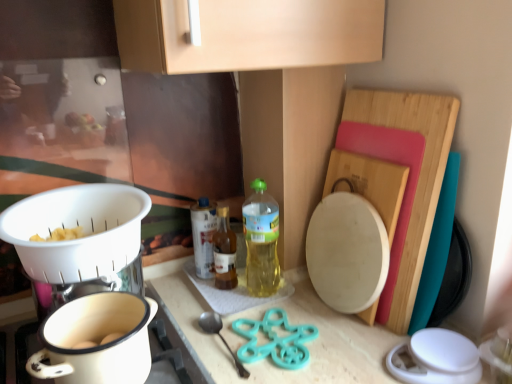
What is the approximate width of translucent plastic bottle at center, positioned as the 1th bottle in left-to-right order?

3.35 inches.

This screenshot has height=384, width=512. What do you see at coordinates (219, 336) in the screenshot?
I see `teal plastic spoon at lower center` at bounding box center [219, 336].

Where is `translucent plastic bottle at center, which ranks as the 3th bottle in left-to-right order`? Image resolution: width=512 pixels, height=384 pixels. translucent plastic bottle at center, which ranks as the 3th bottle in left-to-right order is located at coordinates (261, 241).

The image size is (512, 384). Describe the element at coordinates (261, 241) in the screenshot. I see `translucent plastic bottle at center, which is the 1th bottle from right to left` at that location.

Find the location of `white ceramic pot at lower left`. white ceramic pot at lower left is located at coordinates (96, 341).

The height and width of the screenshot is (384, 512). Find the location of `white plastic colander at left`. white plastic colander at left is located at coordinates (81, 236).

Is teal plastic spoon at lower center oriented towards translucent glass bottle at center, marked as the second bottle in a left-to-right arrangement?

No.

From the image's perspective, which is below, teal plastic spoon at lower center or translucent glass bottle at center, marked as the second bottle in a left-to-right arrangement?

teal plastic spoon at lower center, from the image's perspective.

Do you think teal plastic spoon at lower center is within translucent glass bottle at center, acting as the 2th bottle starting from the right, or outside of it?

teal plastic spoon at lower center is not enclosed by translucent glass bottle at center, acting as the 2th bottle starting from the right.

Based on their sizes in the image, would you say teal plastic spoon at lower center is bigger or smaller than translucent glass bottle at center, marked as the second bottle in a left-to-right arrangement?

teal plastic spoon at lower center is smaller than translucent glass bottle at center, marked as the second bottle in a left-to-right arrangement.

Visually, is teal plastic spoon at lower center positioned to the left or to the right of wooden cutting board at right?

teal plastic spoon at lower center is positioned on wooden cutting board at right's left side.

Does teal plastic spoon at lower center contain wooden cutting board at right?

That's incorrect, wooden cutting board at right is not inside teal plastic spoon at lower center.

Is point (211, 323) farther from camera compared to point (377, 168)?

Yes, point (211, 323) is farther from viewer.

Between translucent plastic bottle at center, positioned as the 1th bottle in left-to-right order, and translucent glass bottle at center, marked as the second bottle in a left-to-right arrangement, which one appears on the right side from the viewer's perspective?

From the viewer's perspective, translucent glass bottle at center, marked as the second bottle in a left-to-right arrangement, appears more on the right side.

Looking at this image, who is bigger, translucent plastic bottle at center, marked as the 3th bottle in a right-to-left arrangement, or translucent glass bottle at center, acting as the 2th bottle starting from the right?

With larger size is translucent plastic bottle at center, marked as the 3th bottle in a right-to-left arrangement.

In the scene shown: Is translucent plastic bottle at center, marked as the 3th bottle in a right-to-left arrangement, in front of or behind translucent glass bottle at center, marked as the second bottle in a left-to-right arrangement, in the image?

Visually, translucent plastic bottle at center, marked as the 3th bottle in a right-to-left arrangement, is located behind translucent glass bottle at center, marked as the second bottle in a left-to-right arrangement.

From a real-world perspective, is translucent plastic bottle at center, positioned as the 1th bottle in left-to-right order, located beneath translucent glass bottle at center, marked as the second bottle in a left-to-right arrangement?

No, from a real-world perspective, translucent plastic bottle at center, positioned as the 1th bottle in left-to-right order, is not beneath translucent glass bottle at center, marked as the second bottle in a left-to-right arrangement.

Is translucent glass bottle at center, acting as the 2th bottle starting from the right, placed right next to white ceramic pot at lower left?

translucent glass bottle at center, acting as the 2th bottle starting from the right, and white ceramic pot at lower left are clearly separated.

From a real-world perspective, which object rests below the other?

In real-world perspective, translucent glass bottle at center, marked as the second bottle in a left-to-right arrangement, is lower.

Would you say translucent glass bottle at center, marked as the second bottle in a left-to-right arrangement, is outside white ceramic pot at lower left?

Yes, translucent glass bottle at center, marked as the second bottle in a left-to-right arrangement, is not within white ceramic pot at lower left.

Is translucent plastic bottle at center, positioned as the 1th bottle in left-to-right order, looking in the opposite direction of white plastic colander at left?

No, translucent plastic bottle at center, positioned as the 1th bottle in left-to-right order, is not facing the opposite direction of white plastic colander at left.

Between translucent plastic bottle at center, marked as the 3th bottle in a right-to-left arrangement, and white plastic colander at left, which one has smaller size?

translucent plastic bottle at center, marked as the 3th bottle in a right-to-left arrangement, is smaller.

From a real-world perspective, is translucent plastic bottle at center, positioned as the 1th bottle in left-to-right order, physically located above or below white plastic colander at left?

Clearly, from a real-world perspective, translucent plastic bottle at center, positioned as the 1th bottle in left-to-right order, is below white plastic colander at left.

What's the angular difference between translucent plastic bottle at center, positioned as the 1th bottle in left-to-right order, and white plastic colander at left's facing directions?

0.00376 degrees.

Find the location of a particular element. bottle that is the 1st object located below the translucent plastic bottle at center, which ranks as the 3th bottle in left-to-right order (from the image's perspective) is located at coordinates (203, 236).

How different are the orientations of translucent plastic bottle at center, which is the 1th bottle from right to left, and translucent plastic bottle at center, positioned as the 1th bottle in left-to-right order, in degrees?

The angle between the facing direction of translucent plastic bottle at center, which is the 1th bottle from right to left, and the facing direction of translucent plastic bottle at center, positioned as the 1th bottle in left-to-right order, is 0.00359 degrees.

Are translucent plastic bottle at center, which is the 1th bottle from right to left, and translucent plastic bottle at center, marked as the 3th bottle in a right-to-left arrangement, far apart?

That's not correct — translucent plastic bottle at center, which is the 1th bottle from right to left, is a little close to translucent plastic bottle at center, marked as the 3th bottle in a right-to-left arrangement.

Which object is positioned more to the right, translucent plastic bottle at center, which ranks as the 3th bottle in left-to-right order, or teal plastic spoon at lower center?

translucent plastic bottle at center, which ranks as the 3th bottle in left-to-right order, is more to the right.

In the scene shown: How different are the orientations of translucent plastic bottle at center, which ranks as the 3th bottle in left-to-right order, and teal plastic spoon at lower center in degrees?

0.00221 degrees separate the facing orientations of translucent plastic bottle at center, which ranks as the 3th bottle in left-to-right order, and teal plastic spoon at lower center.

Considering their positions, is translucent plastic bottle at center, which ranks as the 3th bottle in left-to-right order, located in front of or behind teal plastic spoon at lower center?

In the image, translucent plastic bottle at center, which ranks as the 3th bottle in left-to-right order, appears behind teal plastic spoon at lower center.

Is translucent plastic bottle at center, which ranks as the 3th bottle in left-to-right order, surrounding teal plastic spoon at lower center?

No, teal plastic spoon at lower center is not surrounded by translucent plastic bottle at center, which ranks as the 3th bottle in left-to-right order.

From a real-world perspective, count 1st bottles upward from the teal plastic spoon at lower center and point to it. Please provide its 2D coordinates.

[(224, 251)]

Locate an element on the screen. utensil behind the wooden cutting board at right is located at coordinates (219, 336).

Which object lies nearer to the anchor point white ceramic pot at lower left, white plastic colander at left or teal plastic spoon at lower center?

white plastic colander at left is closer to white ceramic pot at lower left.

From the image, which object appears to be farther from wooden cutting board at right, white plastic colander at left or translucent glass bottle at center, marked as the second bottle in a left-to-right arrangement?

Among the two, white plastic colander at left is located further to wooden cutting board at right.

Considering their positions, is wooden cutting board at right positioned further to translucent plastic bottle at center, which ranks as the 3th bottle in left-to-right order, than white plastic colander at left?

white plastic colander at left.

From the image, which object appears to be farther from white ceramic pot at lower left, translucent plastic bottle at center, marked as the 3th bottle in a right-to-left arrangement, or translucent glass bottle at center, acting as the 2th bottle starting from the right?

translucent plastic bottle at center, marked as the 3th bottle in a right-to-left arrangement, lies further to white ceramic pot at lower left than the other object.

When comparing their distances from white ceramic pot at lower left, does white plastic colander at left or translucent plastic bottle at center, marked as the 3th bottle in a right-to-left arrangement, seem closer?

white plastic colander at left lies closer to white ceramic pot at lower left than the other object.

When comparing their distances from teal plastic spoon at lower center, does translucent glass bottle at center, marked as the second bottle in a left-to-right arrangement, or translucent plastic bottle at center, positioned as the 1th bottle in left-to-right order, seem closer?

translucent glass bottle at center, marked as the second bottle in a left-to-right arrangement, lies closer to teal plastic spoon at lower center than the other object.

Considering their positions, is translucent plastic bottle at center, which ranks as the 3th bottle in left-to-right order, positioned further to white plastic colander at left than translucent glass bottle at center, marked as the second bottle in a left-to-right arrangement?

translucent plastic bottle at center, which ranks as the 3th bottle in left-to-right order, lies further to white plastic colander at left than the other object.

When comparing their distances from teal plastic spoon at lower center, does translucent plastic bottle at center, positioned as the 1th bottle in left-to-right order, or translucent plastic bottle at center, which ranks as the 3th bottle in left-to-right order, seem closer?

Among the two, translucent plastic bottle at center, positioned as the 1th bottle in left-to-right order, is located nearer to teal plastic spoon at lower center.

The width and height of the screenshot is (512, 384). I want to click on bottle situated between translucent plastic bottle at center, positioned as the 1th bottle in left-to-right order, and translucent plastic bottle at center, which is the 1th bottle from right to left, from left to right, so click(x=224, y=251).

Where is `utensil positioned between wooden cutting board at right and translucent plastic bottle at center, positioned as the 1th bottle in left-to-right order, from near to far`? utensil positioned between wooden cutting board at right and translucent plastic bottle at center, positioned as the 1th bottle in left-to-right order, from near to far is located at coordinates (219, 336).

At what (x,y) coordinates should I click in order to perform the action: click on bottle located between teal plastic spoon at lower center and translucent glass bottle at center, marked as the second bottle in a left-to-right arrangement, in the depth direction. Please return your answer as a coordinate pair (x, y). This screenshot has width=512, height=384. Looking at the image, I should click on (261, 241).

The height and width of the screenshot is (384, 512). In order to click on coffee cup between white plastic colander at left and teal plastic spoon at lower center in this screenshot , I will do `click(96, 341)`.